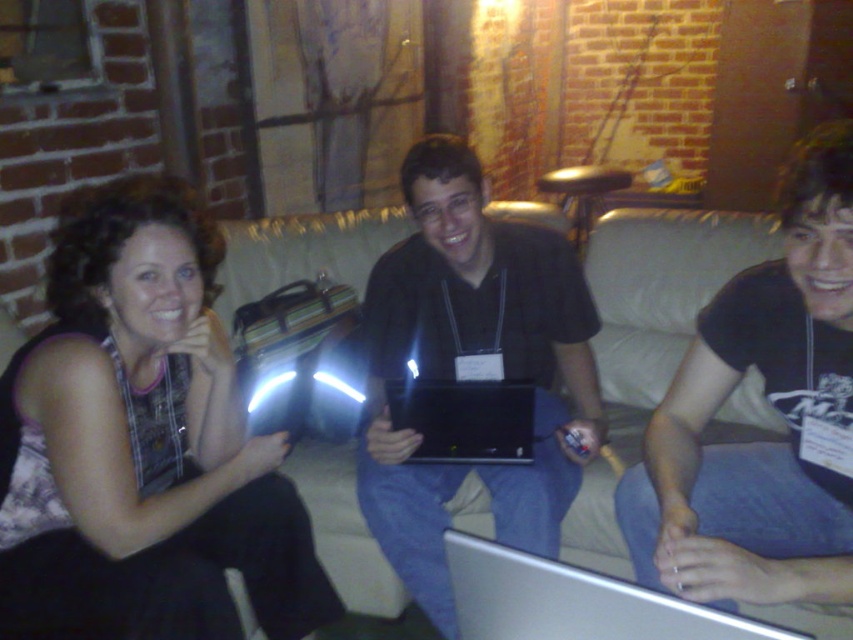
Question: Among these points, which one is farthest from the camera?

Choices:
 (A) (817, 572)
 (B) (463, 458)

Answer: (B)

Question: In this image, where is beige fabric couch at center located relative to silver metallic laptop at lower center?

Choices:
 (A) right
 (B) left

Answer: (A)

Question: Among these points, which one is nearest to the camera?

Choices:
 (A) (119, 221)
 (B) (834, 246)
 (C) (321, 512)

Answer: (B)

Question: Can you confirm if matte black purse at left is positioned to the left of black cotton shirt at center right?

Choices:
 (A) yes
 (B) no

Answer: (A)

Question: Estimate the real-world distances between objects in this image. Which object is closer to the silver metallic laptop at lower center?

Choices:
 (A) black cotton shirt at center right
 (B) black glossy laptop at center
 (C) black matte laptop at center

Answer: (A)

Question: Is beige fabric couch at center below silver metallic laptop at lower center?

Choices:
 (A) yes
 (B) no

Answer: (B)